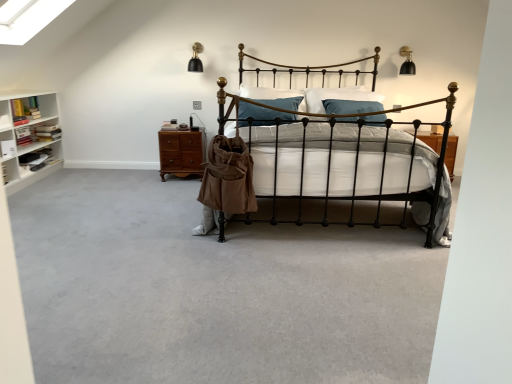
The height and width of the screenshot is (384, 512). Identify the location of free point in front of brown wood drawer at center. (168, 183).